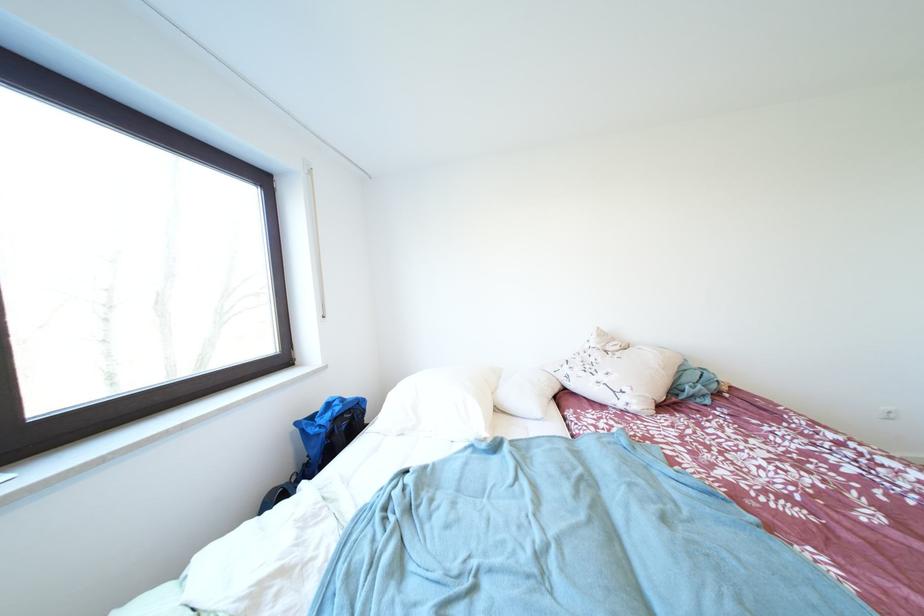
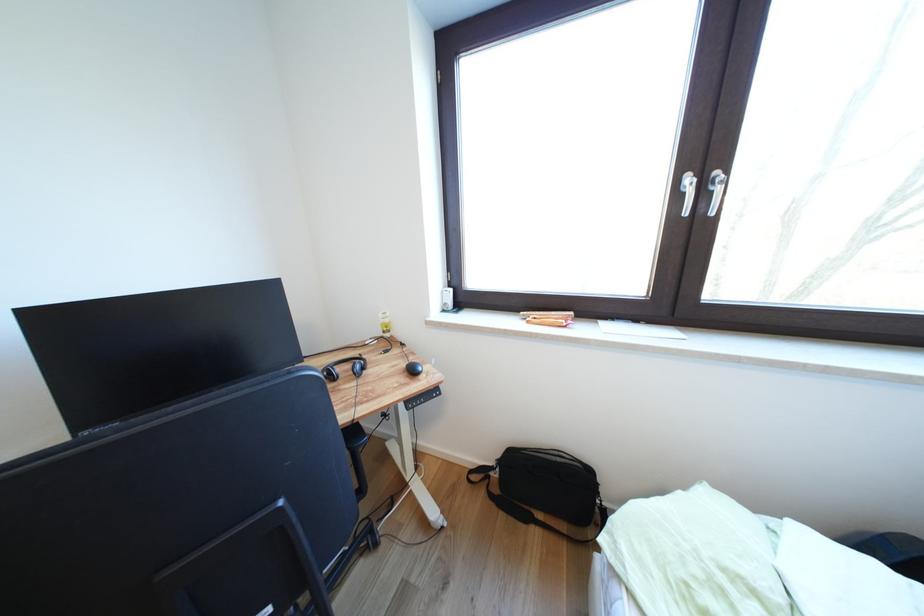
The images are taken continuously from a first-person perspective. In which direction is your viewpoint rotating?

The rotation direction of the camera is left-down.